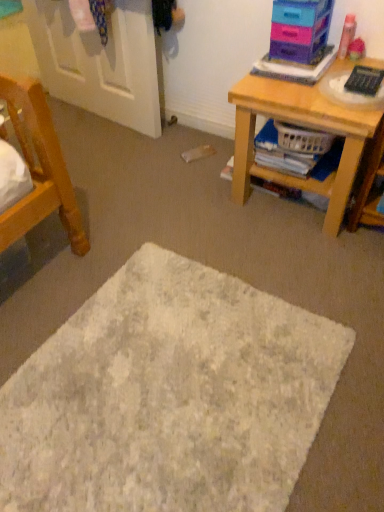
At what (x,y) coordinates should I click in order to perform the action: click on free location in front of white painted wood door at upper left. Please return your answer as a coordinate pair (x, y). Looking at the image, I should click on (105, 155).